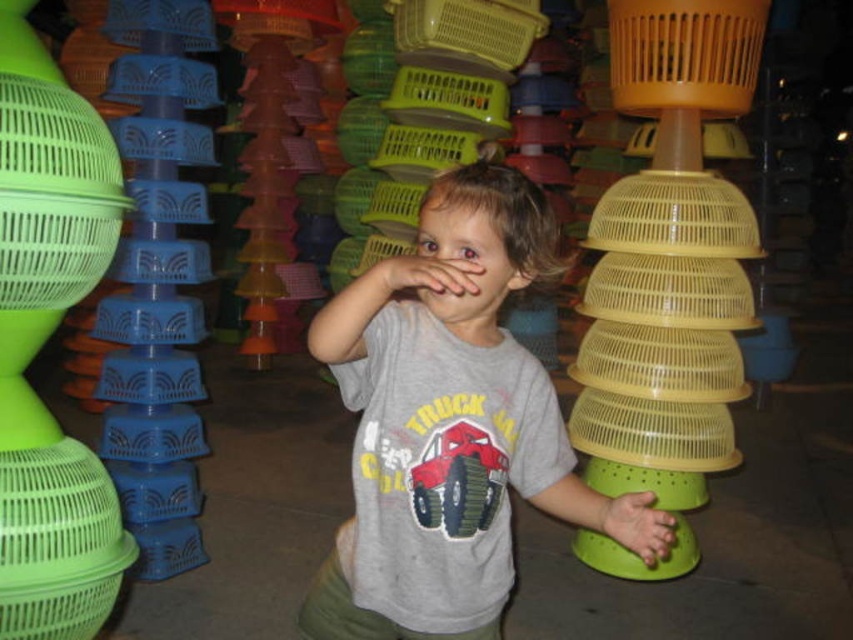
Question: Which object is the farthest from the green matte hand at lower right?

Choices:
 (A) yellow translucent basket at center
 (B) yellow plastic basket at center
 (C) matte yellow plastic colander at center

Answer: (A)

Question: Which object is closer to the camera taking this photo?

Choices:
 (A) green plastic basket at left
 (B) yellow translucent basket at center
 (C) matte skin hand at center

Answer: (C)

Question: Which of these objects is positioned closest to the green plastic basket at left?

Choices:
 (A) green matte hand at lower right
 (B) matte yellow plastic colander at center
 (C) gray cotton shirt at center
 (D) yellow translucent basket at center

Answer: (D)

Question: Is matte yellow plastic colander at center bigger than yellow plastic basket at center?

Choices:
 (A) no
 (B) yes

Answer: (B)

Question: Considering the relative positions of green plastic basket at left and matte skin hand at center in the image provided, where is green plastic basket at left located with respect to matte skin hand at center?

Choices:
 (A) left
 (B) right

Answer: (A)

Question: Does matte yellow plastic colander at center lie in front of yellow translucent basket at center?

Choices:
 (A) no
 (B) yes

Answer: (B)